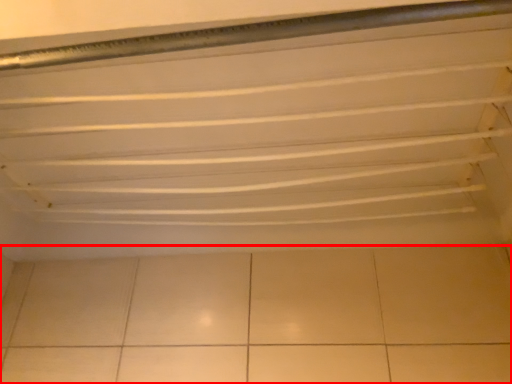
Question: From the image's perspective, considering the relative positions of ceramic tile (annotated by the red box) and shelf in the image provided, where is ceramic tile (annotated by the red box) located with respect to the staircase?

Choices:
 (A) above
 (B) below

Answer: (B)